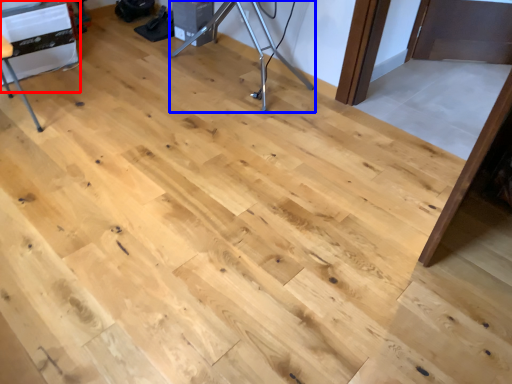
Question: Which point is closer to the camera, table (highlighted by a red box) or tripod (highlighted by a blue box)?

Choices:
 (A) table
 (B) tripod

Answer: (A)